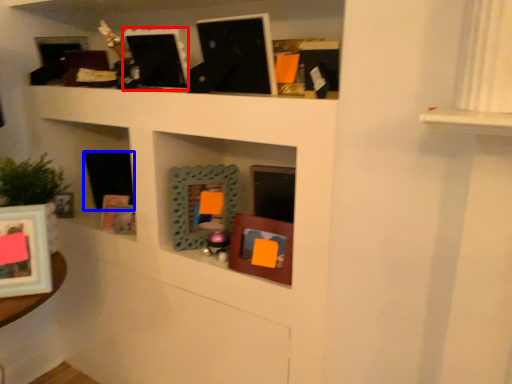
Question: Which object is further to the camera taking this photo, picture frame (highlighted by a red box) or picture frame (highlighted by a blue box)?

Choices:
 (A) picture frame
 (B) picture frame

Answer: (B)